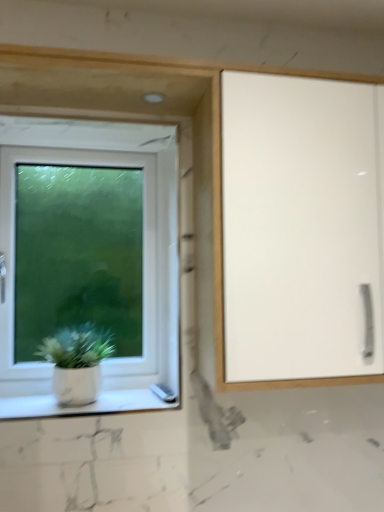
The height and width of the screenshot is (512, 384). Identify the location of blank space situated above white plastic window at left (from a real-world perspective). (102, 132).